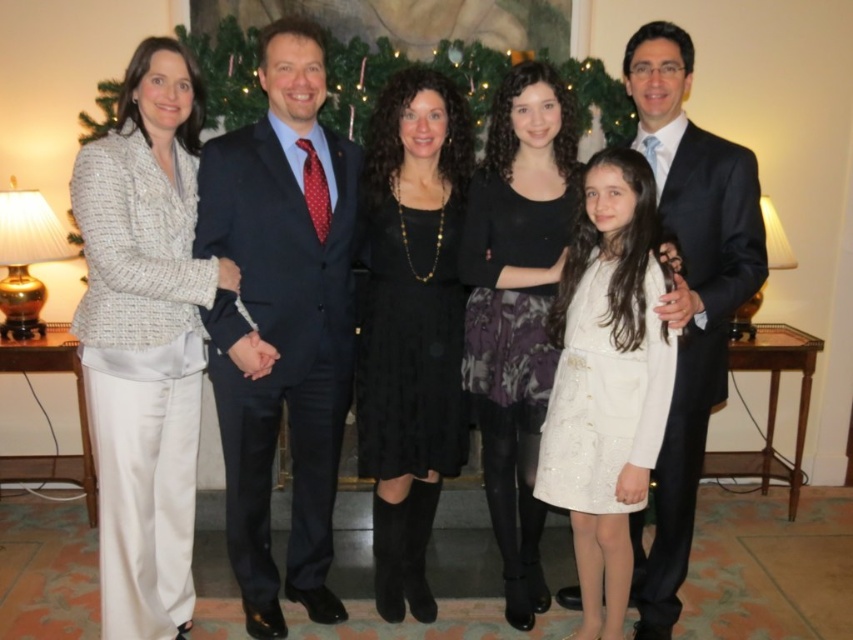
Question: Is white textured blazer at left below satin black suit at center?

Choices:
 (A) yes
 (B) no

Answer: (A)

Question: Which point is closer to the camera?

Choices:
 (A) white textured blazer at left
 (B) green textured wreath at center
 (C) satin black suit at center

Answer: (C)

Question: Among these objects, which one is nearest to the camera?

Choices:
 (A) dark blue suit at center
 (B) white textured blazer at left
 (C) black suede dress at center
 (D) green textured wreath at center

Answer: (B)

Question: Which point is closer to the camera?

Choices:
 (A) (718, 268)
 (B) (158, 634)
 (C) (447, 157)

Answer: (A)

Question: Where is dark blue suit at center located in relation to white textured blazer at left in the image?

Choices:
 (A) right
 (B) left

Answer: (A)

Question: Is the position of black suede dress at center less distant than that of white sequined dress at center?

Choices:
 (A) no
 (B) yes

Answer: (A)